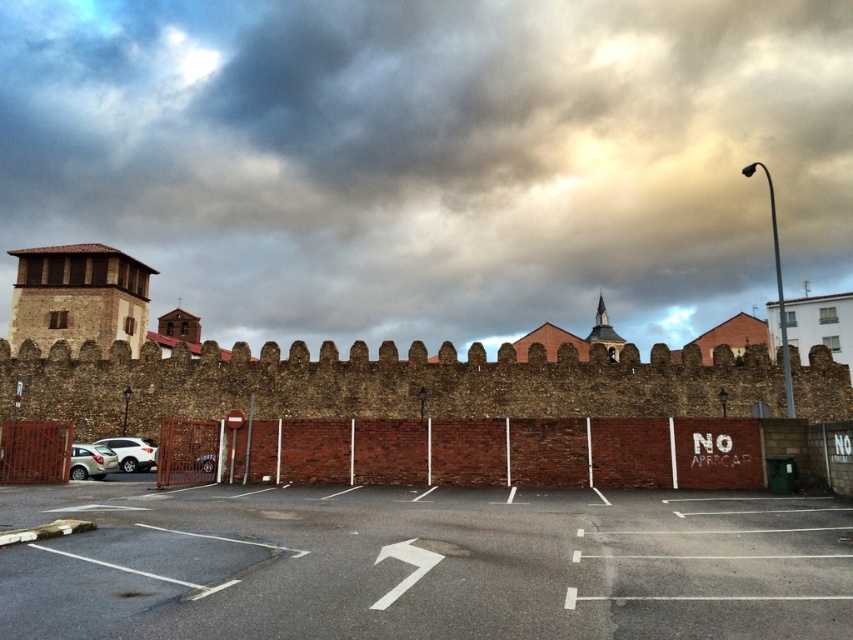
You are a driver looking for a parking spot. You see the gray asphalt parking lot at lower center and the brick wall at center. According to the scene, where is the parking lot located relative to the brick wall?

The gray asphalt parking lot at lower center is positioned under the brick wall at center, so the parking lot is located directly beneath the brick wall.

You are standing in front of the historic stone wall and want to place two markers at the coordinates point [593,621] and point [396,468]. Which marker will be closer to your current position?

Point [593,621] is closer to the viewer than point [396,468], so the marker at point [593,621] will be closer to your current position.